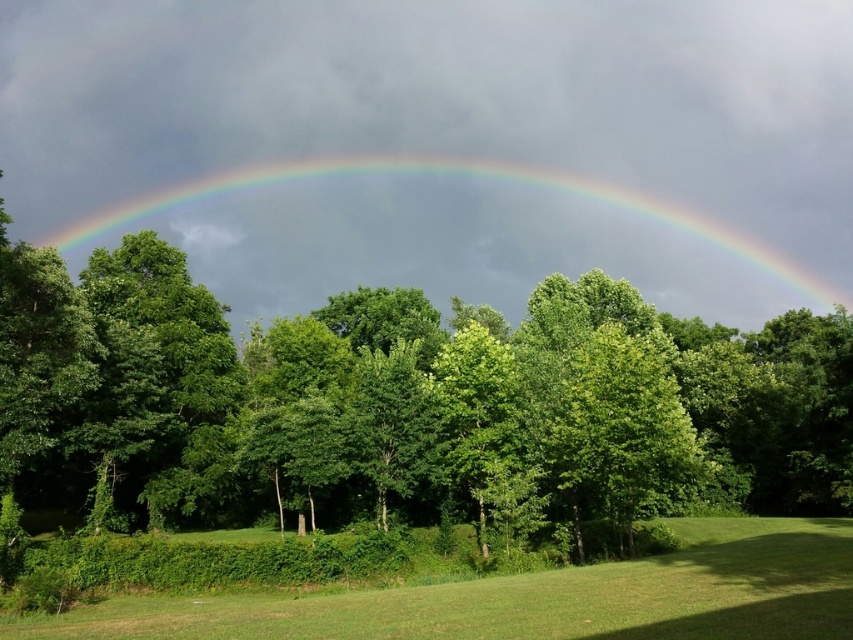
You are standing in the middle of the scene looking forward. Which object is positioned to the left when comparing the rainbow at upper center and the green grass at lower center?

The rainbow at upper center is to the left of the green grass at lower center.

You are a hiker standing at the base of the green leafy tree at center. You want to reach the rainbow at upper center. Can you physically walk towards it? Explain why or why not based on the distance provided.

The rainbow at upper center is 158.31 meters away from the green leafy tree at center. However, rainbows are optical phenomena caused by reflection and refraction of light in water droplets, so they cannot be physically reached by walking towards them regardless of the distance indicated.